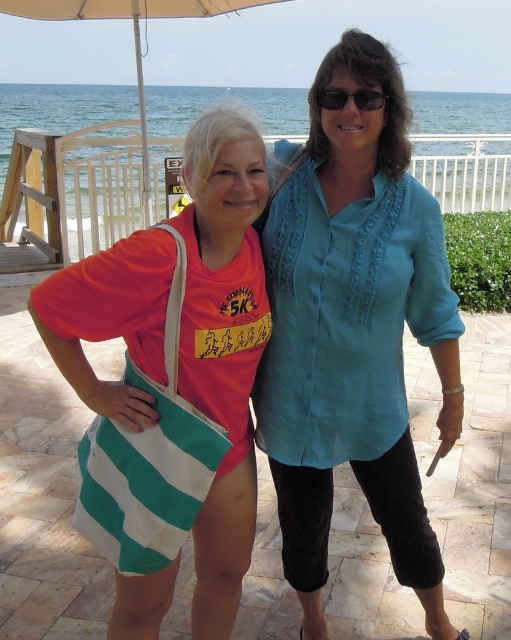
Question: Which object is positioned closest to the beige fabric umbrella at upper center?

Choices:
 (A) black plastic sunglasses at upper center
 (B) teal fabric blouse at center
 (C) green striped tote bag at center

Answer: (A)

Question: Which is farther from the black plastic sunglasses at upper center?

Choices:
 (A) green striped tote bag at center
 (B) beige fabric umbrella at upper center
 (C) teal fabric blouse at center

Answer: (B)

Question: Does green striped tote bag at center appear under beige fabric umbrella at upper center?

Choices:
 (A) yes
 (B) no

Answer: (A)

Question: Which point is closer to the camera?

Choices:
 (A) black plastic sunglasses at upper center
 (B) beige fabric umbrella at upper center
 (C) green striped tote bag at center
 (D) teal fabric blouse at center

Answer: (C)

Question: Is teal fabric blouse at center bigger than green striped tote bag at center?

Choices:
 (A) yes
 (B) no

Answer: (A)

Question: Can you confirm if teal fabric blouse at center is positioned above beige fabric umbrella at upper center?

Choices:
 (A) no
 (B) yes

Answer: (A)